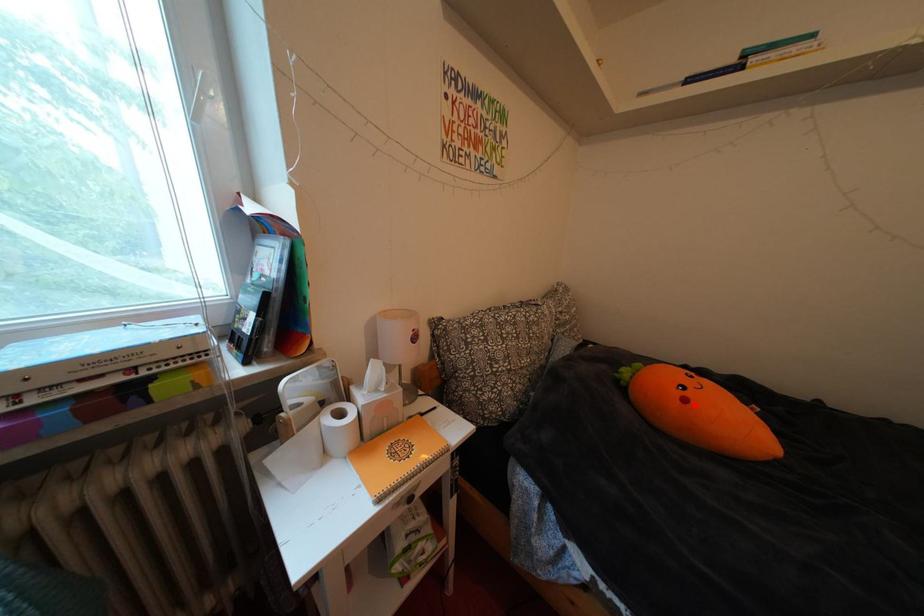
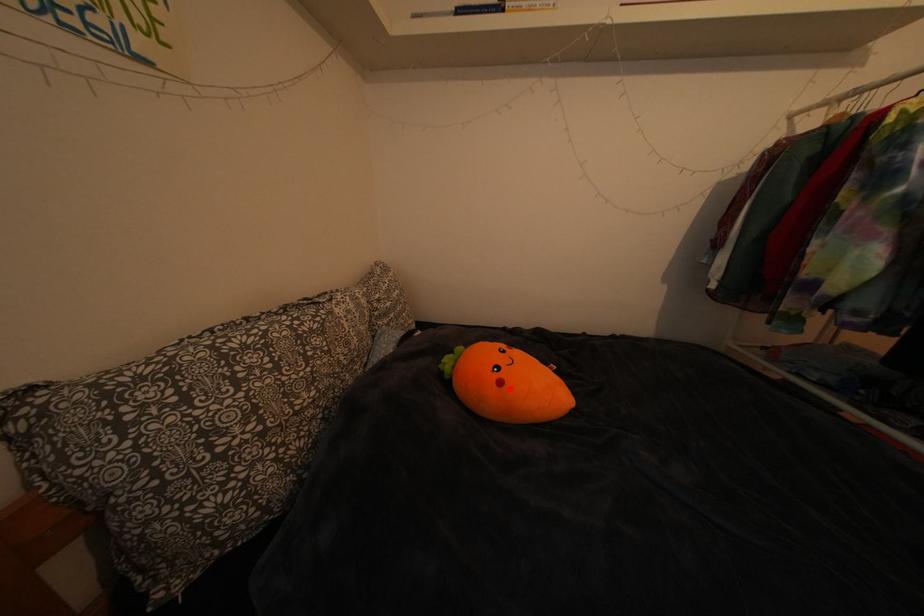
I am providing you with two images of the same scene from different viewpoints. A red point is marked on the first image and another point is marked on the second image. Is the marked point in image1 the same physical position as the marked point in image2?

Yes